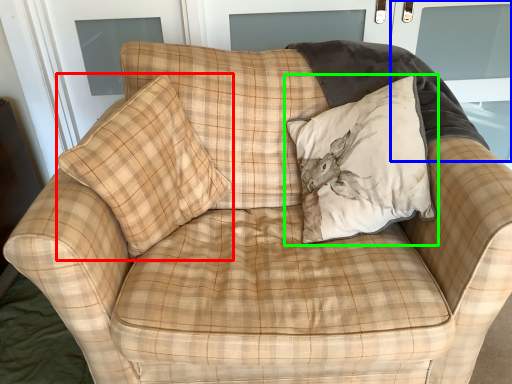
Question: Which is farther away from pillow (highlighted by a red box)? screen door (highlighted by a blue box) or pillow (highlighted by a green box)?

Choices:
 (A) screen door
 (B) pillow

Answer: (A)